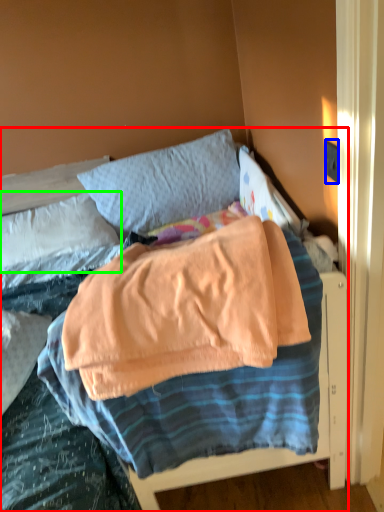
Question: Which object is the farthest from bed (highlighted by a red box)? Choose among these: electric outlet (highlighted by a blue box) or pillow (highlighted by a green box).

Choices:
 (A) electric outlet
 (B) pillow

Answer: (A)